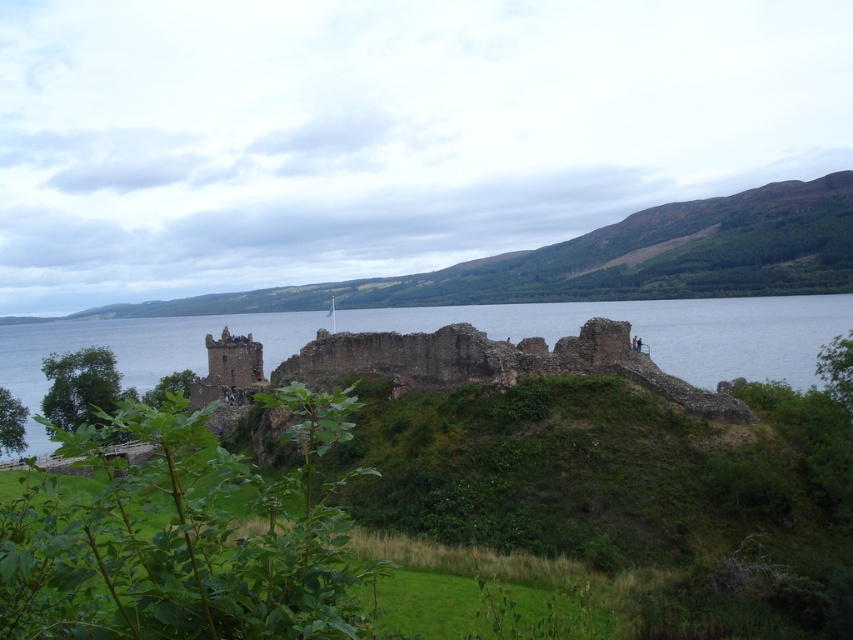
From the picture: You are a tourist visiting Urquhart Castle and want to take a photo that includes both the green grassy hillside at upper center and the brown stone ruins at center. Which object should you position closer to the camera to ensure both are in focus?

Since the green grassy hillside at upper center is smaller in size compared to the brown stone ruins at center, you should position the brown stone ruins at center closer to the camera. This will help ensure both objects are in focus as the smaller hillside will naturally appear farther away.

Based on the photo, you are standing at the ruins of Urquhart Castle overlooking Loch Ness. You notice a point marked at coordinates (608, 260). Which object in the scene does this coordinate point to?

The point at coordinates (608, 260) corresponds to the green grassy hillside at upper center.

You are a hiker standing at the base of the green grassy hillside at upper center and the brown stone ruins at center. Which area has a wider horizontal span when viewed from your perspective?

The brown stone ruins at center has a greater width than the green grassy hillside at upper center, so the brown stone ruins at center is wider.